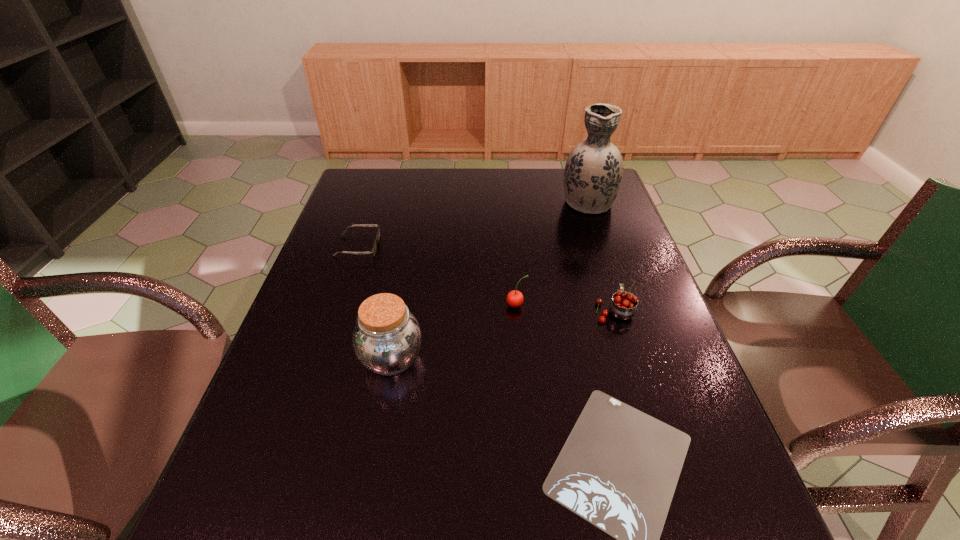
Identify which object is the fourth closest to the fifth shortest object. Please provide its 2D coordinates. Your answer should be formatted as a tuple, i.e. [(x, y)], where the tuple contains the x and y coordinates of a point satisfying the conditions above.

[(623, 305)]

The image size is (960, 540). What are the coordinates of `object that ranks as the closest to the right cherry` in the screenshot? It's located at (514, 298).

The image size is (960, 540). I want to click on free region that satisfies the following two spatial constraints: 1. on the front-facing side of the second farthest object; 2. on the right side of the fifth shortest object, so (x=321, y=359).